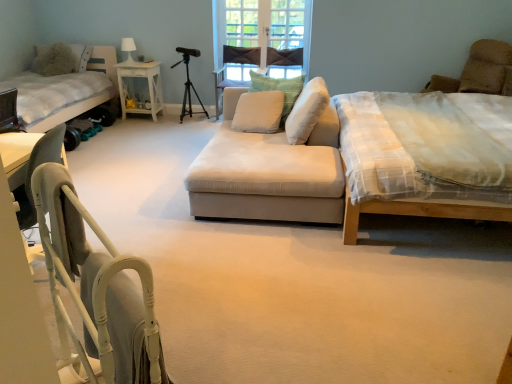
The height and width of the screenshot is (384, 512). Identify the location of vacant position to the left of beige fabric couch at center. (144, 182).